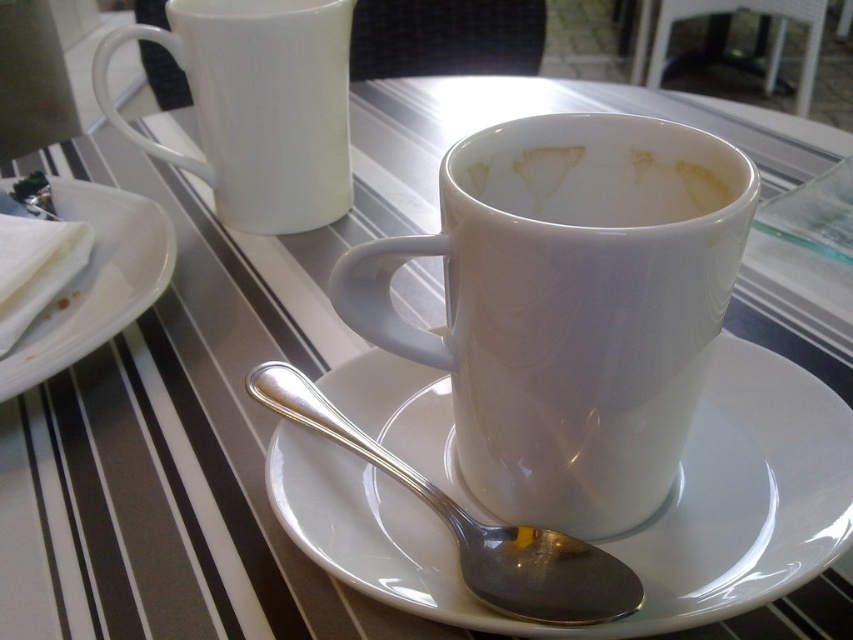
Consider the image. You are a server at a restaurant and need to place a new plate on the table. The plate is 12 inches in diameter. Can you fit it on the table without overlapping the white ceramic saucer at center or the white paper napkin at left?

The white ceramic saucer at center is wider than the white paper napkin at left. Since the plate is 12 inches in diameter, you need to ensure there is enough space between the saucer and napkin to accommodate it. However, without knowing the exact dimensions of the saucer and napkin, it is impossible to determine if the plate will fit without overlapping.

You are a barista trying to place a new cup on the table. The white ceramic saucer at center and the white glossy mug at upper center are already there. Which object has a wider base to support a larger drink container?

The white ceramic saucer at center has a larger width than the white glossy mug at upper center, making it better suited to support a larger drink container.

You are a barista who needs to place a 12.5 inch wide cake on the table. The cake must be placed between the white ceramic saucer at center and the white glossy mug at upper center. Is there enough space for the cake?

The distance between the white ceramic saucer at center and the white glossy mug at upper center is 12.76 inches. Since the cake is 12.5 inches wide, there is enough space to place it between them.